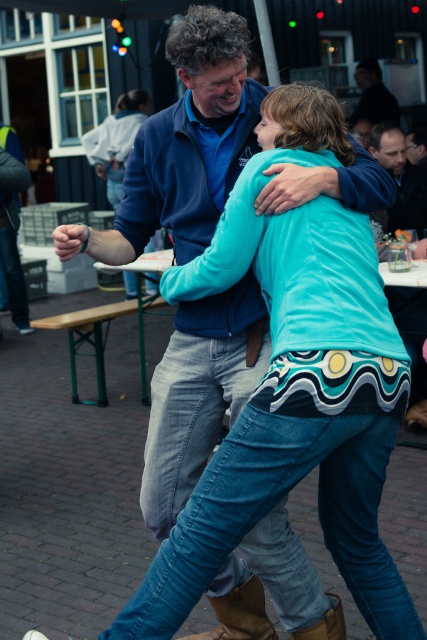
Who is lower down, dark blue fleece at upper right or dark blue shirt at upper center?

dark blue fleece at upper right is below.

Can you confirm if dark blue fleece at upper right is smaller than dark blue shirt at upper center?

Yes, dark blue fleece at upper right is smaller than dark blue shirt at upper center.

Between point (371, 136) and point (392, 97), which one is positioned in front?

Positioned in front is point (371, 136).

Identify the location of dark blue fleece at upper right. The image size is (427, 640). (400, 179).

Does turquoise fabric jacket at center lie in front of dark blue shirt at upper center?

Yes.

Is point (139, 100) farther from viewer compared to point (357, 104)?

That is False.

Locate an element on the screen. turquoise fabric jacket at center is located at coordinates (116, 140).

Is turquoise fabric jacket at center thinner than dark blue fleece at upper right?

No.

Between turquoise fabric jacket at center and dark blue fleece at upper right, which one has less height?

With less height is dark blue fleece at upper right.

Between point (131, 273) and point (424, 218), which one is positioned behind?

Point (131, 273)

At what (x,y) coordinates should I click in order to perform the action: click on turquoise fabric jacket at center. Please return your answer as a coordinate pair (x, y). The height and width of the screenshot is (640, 427). Looking at the image, I should click on click(x=116, y=140).